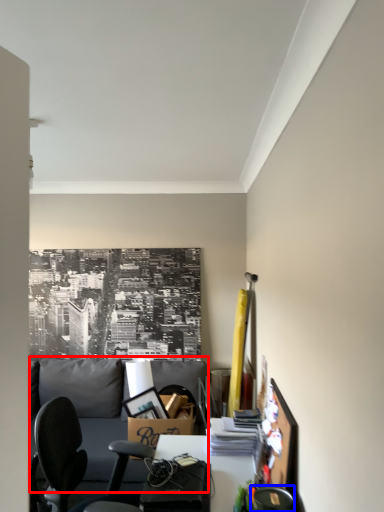
Question: Which point is closer to the camera, couch (highlighted by a red box) or chair (highlighted by a blue box)?

Choices:
 (A) couch
 (B) chair

Answer: (B)